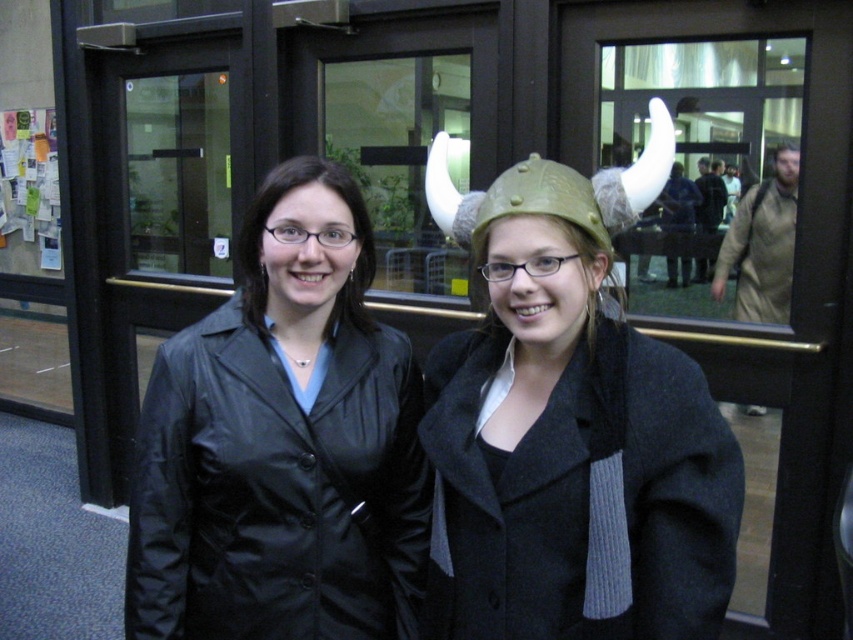
You are trying to decide which helmet to choose for a costume party. Both the gold metallic helmet at center and the matte olive green helmet at center are options. Based on their positions in the image, which one is closer to you?

The gold metallic helmet at center is closer because the matte olive green helmet at center is positioned behind it.

You are trying to determine the order of the two items in the image. Which item is placed higher up, the matte gold helmet at center or the black leather jacket at center?

The matte gold helmet at center is positioned over the black leather jacket at center, so the matte gold helmet at center is higher up.

You are trying to determine which object is closer to you in the scene. Based on the description, which one is nearer to your viewpoint between the matte gold helmet at center and the black leather jacket at center?

The matte gold helmet at center is closer to your viewpoint because it is positioned in front of the black leather jacket at center.